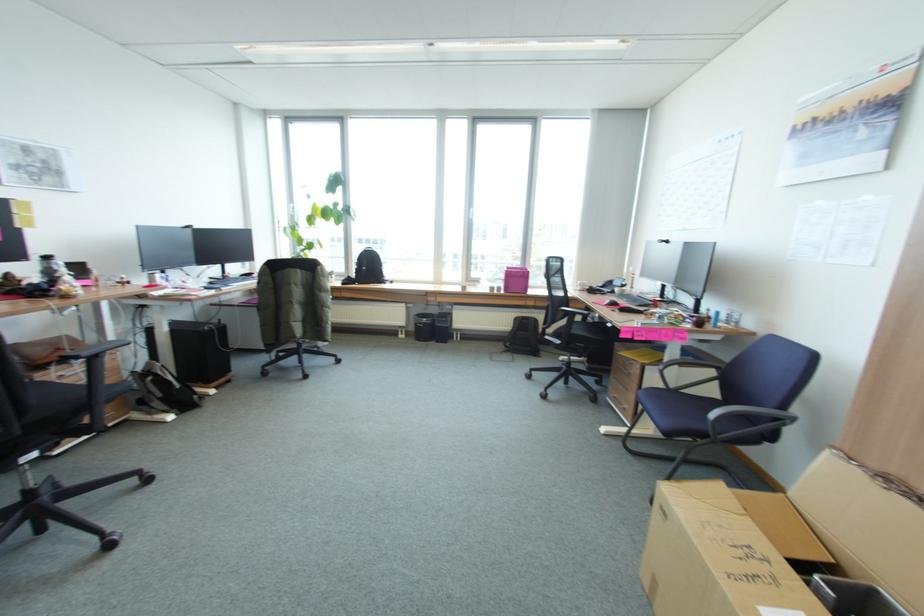
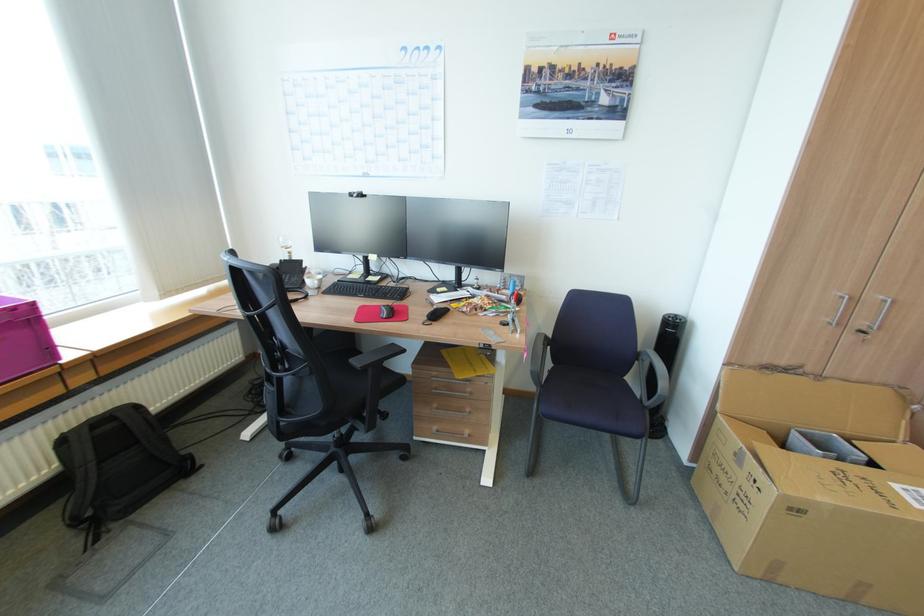
Where in the second image is the point corresponding to (529,272) from the first image?

(21, 309)